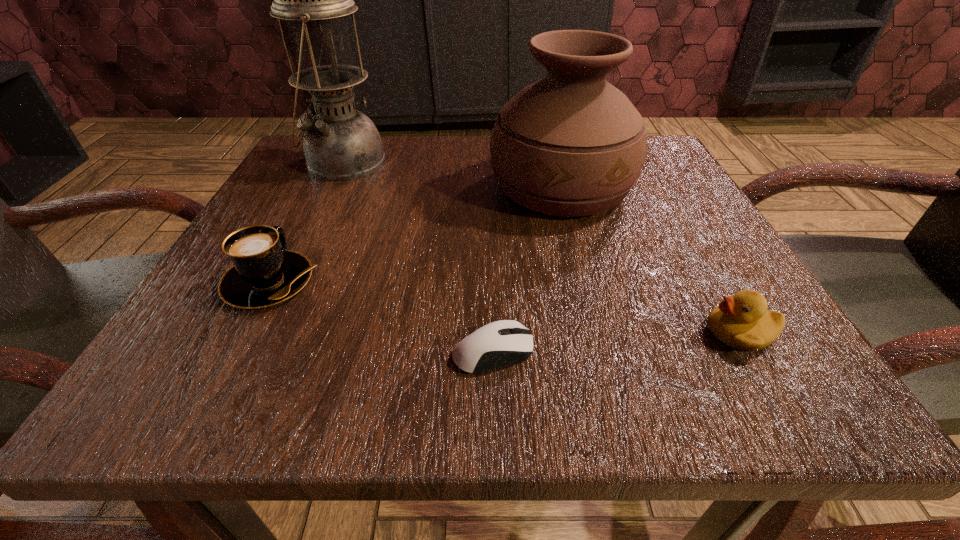
The width and height of the screenshot is (960, 540). I want to click on free location located on the front-facing side of the rightmost object, so click(x=650, y=332).

Where is `free space located 0.090m on the left of the mouse`? This screenshot has height=540, width=960. free space located 0.090m on the left of the mouse is located at coordinates (376, 351).

Find the location of a particular element. oil lamp present at the far edge is located at coordinates (340, 143).

Locate an element on the screen. This screenshot has width=960, height=540. urn that is positioned at the far edge is located at coordinates (571, 144).

Where is `duckling that is at the near edge`? duckling that is at the near edge is located at coordinates (742, 321).

Image resolution: width=960 pixels, height=540 pixels. Identify the location of mouse that is at the near edge. (501, 343).

Locate an element on the screen. This screenshot has width=960, height=540. oil lamp that is at the left edge is located at coordinates (340, 143).

Find the location of `cappuccino located in the left edge section of the desktop`. cappuccino located in the left edge section of the desktop is located at coordinates (264, 273).

Where is `urn located in the right edge section of the desktop`? urn located in the right edge section of the desktop is located at coordinates (571, 144).

You are a GUI agent. You are given a task and a screenshot of the screen. Output one action in this format:
    pyautogui.click(x=<x>, y=<y>)
    Task: Click on the duckling present at the right edge
    The image size is (960, 540).
    Given the screenshot: What is the action you would take?
    pyautogui.click(x=742, y=321)